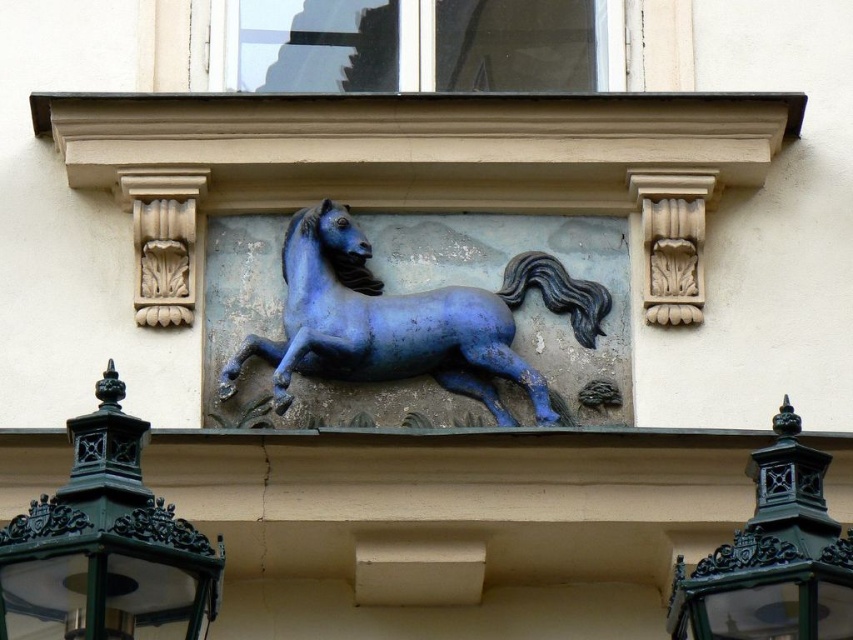
Can you confirm if green cast iron lamp at lower left is bigger than green cast iron lantern at lower right?

Correct, green cast iron lamp at lower left is larger in size than green cast iron lantern at lower right.

Does green cast iron lamp at lower left appear over green cast iron lantern at lower right?

Indeed, green cast iron lamp at lower left is positioned over green cast iron lantern at lower right.

Who is more forward, (175, 541) or (828, 552)?

Positioned in front is point (175, 541).

Locate an element on the screen. green cast iron lamp at lower left is located at coordinates (106, 547).

How distant is glossy blue horse at center from green cast iron lantern at lower right?

glossy blue horse at center is 12.33 meters away from green cast iron lantern at lower right.

Looking at this image, does glossy blue horse at center come in front of green cast iron lantern at lower right?

No, glossy blue horse at center is further to the viewer.

Who is more distant from viewer, (x=289, y=337) or (x=767, y=570)?

The point (x=289, y=337) is behind.

Where is `glossy blue horse at center`? This screenshot has width=853, height=640. glossy blue horse at center is located at coordinates (407, 321).

Can you confirm if glossy blue horse at center is positioned to the right of green cast iron lamp at lower left?

Correct, you'll find glossy blue horse at center to the right of green cast iron lamp at lower left.

Which of these two, glossy blue horse at center or green cast iron lamp at lower left, stands taller?

glossy blue horse at center

The height and width of the screenshot is (640, 853). In order to click on glossy blue horse at center in this screenshot , I will do `click(407, 321)`.